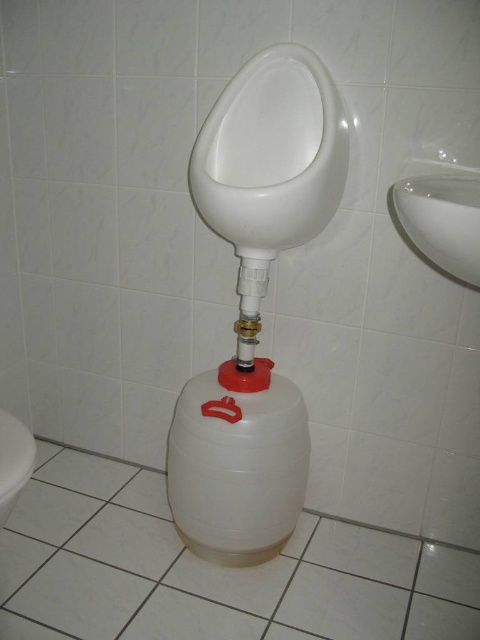
What do you see at coordinates (237, 461) in the screenshot? Image resolution: width=480 pixels, height=640 pixels. I see `white plastic bidet at center` at bounding box center [237, 461].

Is white plastic bidet at center shorter than white plastic bidet at lower left?

In fact, white plastic bidet at center may be taller than white plastic bidet at lower left.

You are a GUI agent. You are given a task and a screenshot of the screen. Output one action in this format:
    pyautogui.click(x=<x>, y=<y>)
    Task: Click on the white plastic bidet at center
    
    Given the screenshot: What is the action you would take?
    pyautogui.click(x=237, y=461)

Find the location of a particular element. The image size is (480, 640). white plastic bidet at center is located at coordinates (237, 461).

Is white matte bidet at upper center in front of white plastic bidet at lower left?

No, white matte bidet at upper center is behind white plastic bidet at lower left.

Is white matte bidet at upper center bigger than white plastic bidet at lower left?

Indeed, white matte bidet at upper center has a larger size compared to white plastic bidet at lower left.

Is point (215, 122) more distant than point (2, 470)?

Yes, point (215, 122) is behind point (2, 470).

Identify the location of white matte bidet at upper center. The image size is (480, 640). (272, 154).

Can you confirm if white plastic bidet at center is wider than white glossy sink at upper right?

Indeed, white plastic bidet at center has a greater width compared to white glossy sink at upper right.

Does white plastic bidet at center appear under white glossy sink at upper right?

Yes, white plastic bidet at center is below white glossy sink at upper right.

Is point (274, 412) farther from viewer compared to point (458, 182)?

That is True.

Where is `white plastic bidet at center`? white plastic bidet at center is located at coordinates (237, 461).